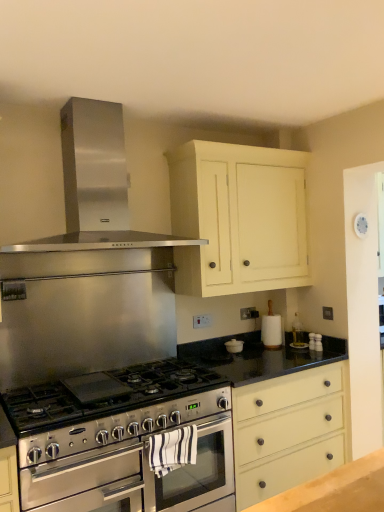
Describe the element at coordinates (90, 177) in the screenshot. I see `stainless steel exhaust hood at upper center` at that location.

This screenshot has width=384, height=512. Find the location of `stainless steel oven at center, arranged as the second oven when viewed from the front`. stainless steel oven at center, arranged as the second oven when viewed from the front is located at coordinates (194, 469).

Describe the element at coordinates (136, 475) in the screenshot. The height and width of the screenshot is (512, 384). I see `stainless steel oven at center, marked as the 1th oven in a front-to-back arrangement` at that location.

The height and width of the screenshot is (512, 384). Describe the element at coordinates (103, 394) in the screenshot. I see `stainless steel gas stove at center` at that location.

Locate an element on the screen. This screenshot has width=384, height=512. matte cream drawer at center is located at coordinates (288, 431).

Find the location of `stainless steel exhaust hood at upper center`. stainless steel exhaust hood at upper center is located at coordinates (90, 177).

Is stainless steel oven at center, marked as the 1th oven in a front-to-back arrangement, positioned with its back to matte cream drawer at center?

stainless steel oven at center, marked as the 1th oven in a front-to-back arrangement, does not have its back to matte cream drawer at center.

Can you tell me how much stainless steel oven at center, marked as the 1th oven in a front-to-back arrangement, and matte cream drawer at center differ in facing direction?

0.216 degrees.

Is stainless steel oven at center, which appears as the second oven when viewed from the back, inside the boundaries of matte cream drawer at center, or outside?

stainless steel oven at center, which appears as the second oven when viewed from the back, is not inside matte cream drawer at center, it's outside.

Is there a large distance between stainless steel oven at center, marked as the 1th oven in a front-to-back arrangement, and matte cream drawer at center?

No, stainless steel oven at center, marked as the 1th oven in a front-to-back arrangement, is in close proximity to matte cream drawer at center.

In the image, is stainless steel oven at center, which appears as the second oven when viewed from the back, on the left side or the right side of stainless steel gas stove at center?

Based on their positions, stainless steel oven at center, which appears as the second oven when viewed from the back, is located to the right of stainless steel gas stove at center.

Is stainless steel oven at center, which appears as the second oven when viewed from the back, positioned far away from stainless steel gas stove at center?

That's not correct — stainless steel oven at center, which appears as the second oven when viewed from the back, is a little close to stainless steel gas stove at center.

Is point (208, 457) closer to camera compared to point (162, 420)?

No, it is not.

How different are the orientations of stainless steel oven at center, marked as the 1th oven in a front-to-back arrangement, and stainless steel gas stove at center in degrees?

stainless steel oven at center, marked as the 1th oven in a front-to-back arrangement, and stainless steel gas stove at center are facing 0.00102 degrees away from each other.

Is stainless steel oven at center, arranged as the second oven when viewed from the front, inside stainless steel oven at center, marked as the 1th oven in a front-to-back arrangement?

Yes, stainless steel oven at center, arranged as the second oven when viewed from the front, can be found within stainless steel oven at center, marked as the 1th oven in a front-to-back arrangement.

In terms of height, does stainless steel oven at center, which appears as the second oven when viewed from the back, look taller or shorter compared to stainless steel oven at center, arranged as the second oven when viewed from the front?

stainless steel oven at center, which appears as the second oven when viewed from the back, is taller than stainless steel oven at center, arranged as the second oven when viewed from the front.

Is stainless steel oven at center, which appears as the second oven when viewed from the back, at the right side of stainless steel oven at center, the 1th oven in the back-to-front sequence?

In fact, stainless steel oven at center, which appears as the second oven when viewed from the back, is to the left of stainless steel oven at center, the 1th oven in the back-to-front sequence.

In the scene shown: How far apart are stainless steel oven at center, which appears as the second oven when viewed from the back, and stainless steel oven at center, the 1th oven in the back-to-front sequence?

They are 2.43 inches apart.

Is matte cream drawer at center facing away from stainless steel exhaust hood at upper center?

No, matte cream drawer at center is not facing the opposite direction of stainless steel exhaust hood at upper center.

Which is further, (233,419) or (92,207)?

Point (233,419)

Considering the relative positions of matte cream drawer at center and stainless steel exhaust hood at upper center in the image provided, is matte cream drawer at center in front of stainless steel exhaust hood at upper center?

That is False.

Looking at their sizes, would you say matte cream drawer at center is wider or thinner than stainless steel exhaust hood at upper center?

Considering their sizes, matte cream drawer at center looks broader than stainless steel exhaust hood at upper center.

From a real-world perspective, is matte cream drawer at center above or below stainless steel oven at center, arranged as the second oven when viewed from the front?

matte cream drawer at center is situated lower than stainless steel oven at center, arranged as the second oven when viewed from the front, in the real world.

Is matte cream drawer at center to the right of stainless steel oven at center, arranged as the second oven when viewed from the front, from the viewer's perspective?

Yes, matte cream drawer at center is to the right of stainless steel oven at center, arranged as the second oven when viewed from the front.

From the image's perspective, is matte cream drawer at center located above or below stainless steel oven at center, the 1th oven in the back-to-front sequence?

matte cream drawer at center is below stainless steel oven at center, the 1th oven in the back-to-front sequence.

In the scene shown: Which of these two, matte cream drawer at center or stainless steel oven at center, arranged as the second oven when viewed from the front, is smaller?

Smaller between the two is stainless steel oven at center, arranged as the second oven when viewed from the front.

Looking at this image, which of these two, stainless steel exhaust hood at upper center or matte cream drawer at center, is thinner?

With smaller width is stainless steel exhaust hood at upper center.

Between stainless steel exhaust hood at upper center and matte cream drawer at center, which one appears on the left side from the viewer's perspective?

Positioned to the left is stainless steel exhaust hood at upper center.

Considering the relative positions of stainless steel exhaust hood at upper center and matte cream drawer at center in the image provided, is stainless steel exhaust hood at upper center behind matte cream drawer at center?

No, it is not.

How distant is stainless steel exhaust hood at upper center from matte cream drawer at center?

stainless steel exhaust hood at upper center is 1.30 meters away from matte cream drawer at center.

Do you think stainless steel gas stove at center is within stainless steel oven at center, the 1th oven in the back-to-front sequence, or outside of it?

stainless steel gas stove at center is located beyond the bounds of stainless steel oven at center, the 1th oven in the back-to-front sequence.

Which object is more forward, stainless steel gas stove at center or stainless steel oven at center, the 1th oven in the back-to-front sequence?

stainless steel gas stove at center is more forward.

Can you confirm if stainless steel gas stove at center is positioned to the right of stainless steel oven at center, the 1th oven in the back-to-front sequence?

A: Incorrect, stainless steel gas stove at center is not on the right side of stainless steel oven at center, the 1th oven in the back-to-front sequence.

Find the location of `drawer on the right side of stainless steel oven at center, which appears as the second oven when viewed from the back`. drawer on the right side of stainless steel oven at center, which appears as the second oven when viewed from the back is located at coordinates (288, 431).

The height and width of the screenshot is (512, 384). Find the location of `gas stove in front of the stainless steel oven at center, which appears as the second oven when viewed from the back`. gas stove in front of the stainless steel oven at center, which appears as the second oven when viewed from the back is located at coordinates (103, 394).

Based on their spatial positions, is stainless steel gas stove at center or stainless steel oven at center, which appears as the second oven when viewed from the back, further from stainless steel oven at center, arranged as the second oven when viewed from the front?

stainless steel gas stove at center is positioned further to the anchor stainless steel oven at center, arranged as the second oven when viewed from the front.

Estimate the real-world distances between objects in this image. Which object is further from stainless steel oven at center, the 1th oven in the back-to-front sequence, white painted wood cabinet at upper center or stainless steel oven at center, marked as the 1th oven in a front-to-back arrangement?

white painted wood cabinet at upper center.

Estimate the real-world distances between objects in this image. Which object is further from stainless steel oven at center, arranged as the second oven when viewed from the front, matte cream drawer at center or stainless steel gas stove at center?

Among the two, matte cream drawer at center is located further to stainless steel oven at center, arranged as the second oven when viewed from the front.

When comparing their distances from stainless steel exhaust hood at upper center, does stainless steel gas stove at center or stainless steel oven at center, which appears as the second oven when viewed from the back, seem further?

stainless steel oven at center, which appears as the second oven when viewed from the back.

When comparing their distances from white painted wood cabinet at upper center, does stainless steel oven at center, the 1th oven in the back-to-front sequence, or stainless steel exhaust hood at upper center seem further?

stainless steel oven at center, the 1th oven in the back-to-front sequence, lies further to white painted wood cabinet at upper center than the other object.

Estimate the real-world distances between objects in this image. Which object is closer to matte cream drawer at center, stainless steel exhaust hood at upper center or white painted wood cabinet at upper center?

The object closer to matte cream drawer at center is white painted wood cabinet at upper center.

Based on their spatial positions, is stainless steel gas stove at center or stainless steel oven at center, arranged as the second oven when viewed from the front, further from stainless steel exhaust hood at upper center?

stainless steel oven at center, arranged as the second oven when viewed from the front.

Looking at the image, which one is located further to stainless steel oven at center, the 1th oven in the back-to-front sequence, white painted wood cabinet at upper center or stainless steel gas stove at center?

The object further to stainless steel oven at center, the 1th oven in the back-to-front sequence, is white painted wood cabinet at upper center.

The height and width of the screenshot is (512, 384). I want to click on gas stove between white painted wood cabinet at upper center and stainless steel oven at center, marked as the 1th oven in a front-to-back arrangement, vertically, so click(x=103, y=394).

The image size is (384, 512). I want to click on gas stove between stainless steel exhaust hood at upper center and stainless steel oven at center, which appears as the second oven when viewed from the back, in the vertical direction, so click(x=103, y=394).

Identify the location of drawer that lies between stainless steel exhaust hood at upper center and stainless steel oven at center, marked as the 1th oven in a front-to-back arrangement, from top to bottom. (288, 431).

At what (x,y) coordinates should I click in order to perform the action: click on cabinetry between stainless steel exhaust hood at upper center and stainless steel gas stove at center in the vertical direction. Please return your answer as a coordinate pair (x, y). Looking at the image, I should click on (238, 218).